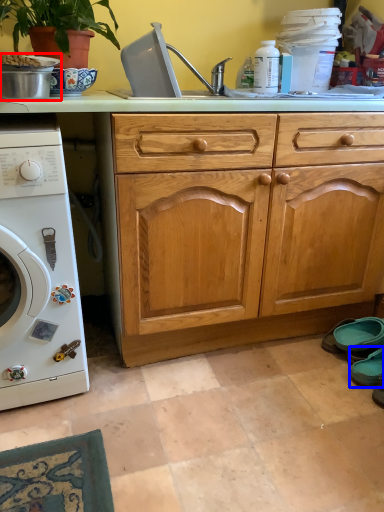
Question: Which point is further to the camera, appliance (highlighted by a red box) or shoe (highlighted by a blue box)?

Choices:
 (A) appliance
 (B) shoe

Answer: (B)